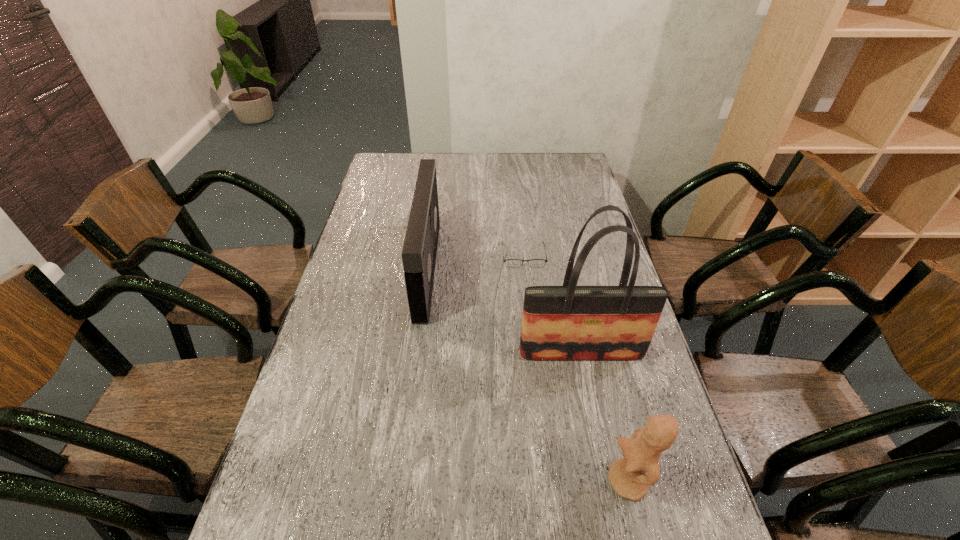
Identify the location of empty location between the tallest object and the leftmost object. Image resolution: width=960 pixels, height=540 pixels. (504, 311).

Find the location of a particular element. empty location between the shopping bag and the figurine is located at coordinates (605, 417).

Locate an element on the screen. vacant area between the nearest object and the shortest object is located at coordinates (576, 368).

The width and height of the screenshot is (960, 540). In order to click on free spot between the figurine and the shortest object in this screenshot , I will do `click(576, 368)`.

Identify the location of vacant region between the spectacles and the videotape. The width and height of the screenshot is (960, 540). (475, 262).

At what (x,y) coordinates should I click in order to perform the action: click on free space between the videotape and the nearest object. Please return your answer as a coordinate pair (x, y). This screenshot has height=540, width=960. Looking at the image, I should click on (528, 375).

At what (x,y) coordinates should I click in order to perform the action: click on the closest object to the spectacles. Please return your answer as a coordinate pair (x, y). The image size is (960, 540). Looking at the image, I should click on (419, 251).

You are a GUI agent. You are given a task and a screenshot of the screen. Output one action in this format:
    pyautogui.click(x=<x>, y=<y>)
    Task: Click on the closest object to the shopping bag
    The image size is (960, 540).
    Given the screenshot: What is the action you would take?
    pyautogui.click(x=630, y=476)

The height and width of the screenshot is (540, 960). What are the coordinates of `free space that satisfies the following two spatial constraints: 1. on the front-facing side of the shortest object; 2. on the front side of the videotape` in the screenshot? It's located at (525, 269).